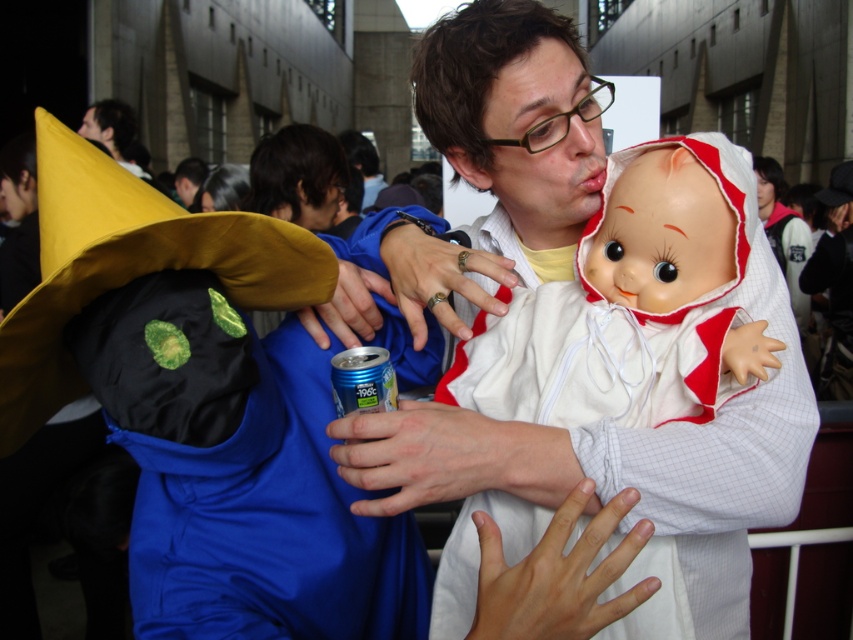
Question: Does black matte fabric at left appear under smooth plastic doll at center?

Choices:
 (A) no
 (B) yes

Answer: (A)

Question: Is black matte fabric at left thinner than smooth plastic doll at center?

Choices:
 (A) no
 (B) yes

Answer: (A)

Question: Is black matte fabric at left above blue metallic can at center?

Choices:
 (A) no
 (B) yes

Answer: (A)

Question: Which point is farther to the camera?

Choices:
 (A) blue metallic can at center
 (B) smooth plastic doll at center
 (C) black matte fabric at left
 (D) dark brown hair at upper left

Answer: (D)

Question: Among these points, which one is farthest from the camera?

Choices:
 (A) (126, 134)
 (B) (390, 369)
 (C) (630, 150)

Answer: (A)

Question: Which object appears closest to the camera in this image?

Choices:
 (A) blue metallic can at center
 (B) dark brown hair at upper left
 (C) black matte fabric at left

Answer: (C)